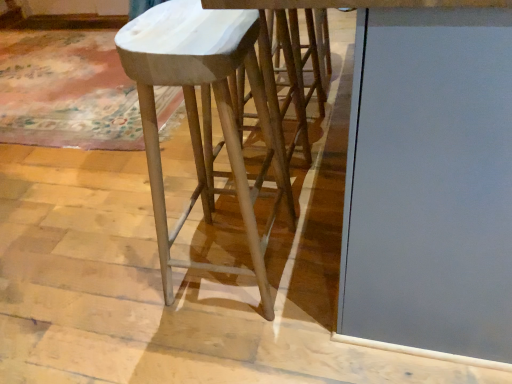
Question: Should I look upward or downward to see matte gray glass door at center?

Choices:
 (A) up
 (B) down

Answer: (A)

Question: Are white marble stool at center and matte gray glass door at center beside each other?

Choices:
 (A) yes
 (B) no

Answer: (B)

Question: Is white marble stool at center bigger than matte gray glass door at center?

Choices:
 (A) yes
 (B) no

Answer: (B)

Question: Would you say white marble stool at center contains matte gray glass door at center?

Choices:
 (A) no
 (B) yes

Answer: (A)

Question: Can you confirm if white marble stool at center is shorter than matte gray glass door at center?

Choices:
 (A) no
 (B) yes

Answer: (B)

Question: Does white marble stool at center have a greater width compared to matte gray glass door at center?

Choices:
 (A) no
 (B) yes

Answer: (A)

Question: Can you confirm if white marble stool at center is positioned to the right of matte gray glass door at center?

Choices:
 (A) no
 (B) yes

Answer: (A)

Question: Is white marble stool at center at the back of matte gray glass door at center?

Choices:
 (A) no
 (B) yes

Answer: (A)

Question: Would you say matte gray glass door at center is outside white marble stool at center?

Choices:
 (A) yes
 (B) no

Answer: (A)

Question: Is matte gray glass door at center at the left side of white marble stool at center?

Choices:
 (A) yes
 (B) no

Answer: (B)

Question: Is the position of matte gray glass door at center less distant than that of white marble stool at center?

Choices:
 (A) no
 (B) yes

Answer: (B)

Question: Is matte gray glass door at center aimed at white marble stool at center?

Choices:
 (A) yes
 (B) no

Answer: (A)

Question: Is the surface of matte gray glass door at center in direct contact with white marble stool at center?

Choices:
 (A) yes
 (B) no

Answer: (B)

Question: Considering the positions of matte gray glass door at center and white marble stool at center in the image, is matte gray glass door at center taller or shorter than white marble stool at center?

Choices:
 (A) tall
 (B) short

Answer: (A)